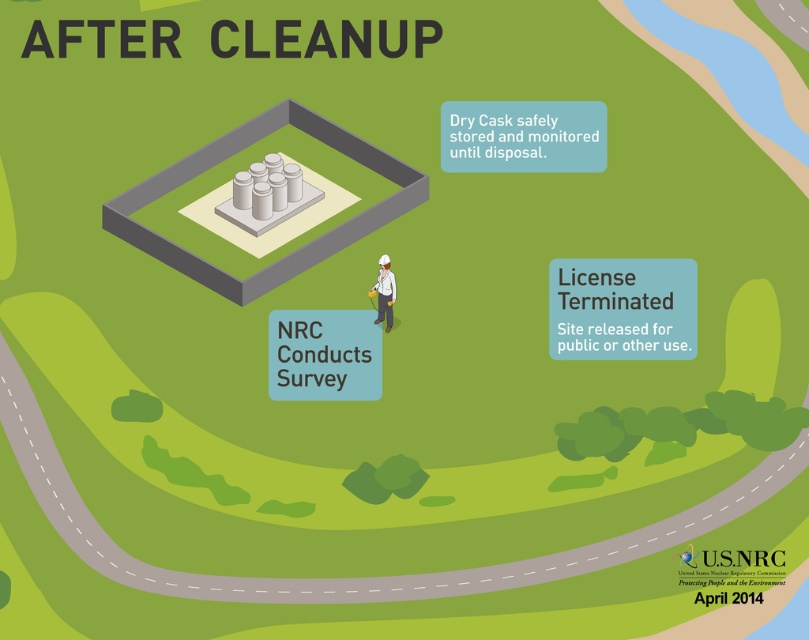
Question: Does matte gray cylinders at center appear over white hard hat at center?

Choices:
 (A) no
 (B) yes

Answer: (B)

Question: Is matte gray cylinders at center bigger than white hard hat at center?

Choices:
 (A) no
 (B) yes

Answer: (B)

Question: Which point appears closest to the camera in this image?

Choices:
 (A) (395, 182)
 (B) (386, 320)

Answer: (B)

Question: Does matte gray cylinders at center have a lesser width compared to white hard hat at center?

Choices:
 (A) no
 (B) yes

Answer: (A)

Question: Which point is closer to the camera taking this photo?

Choices:
 (A) (193, 163)
 (B) (386, 291)

Answer: (A)